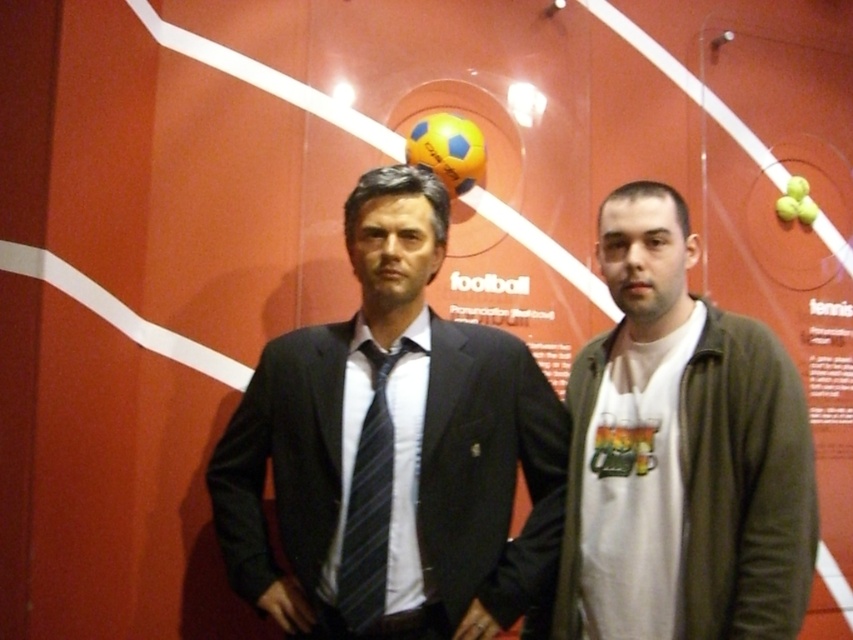
You are a photographer setting up a shoot with two models dressed in dark blue suit at center and black striped tie at center. The client wants the suit to be visible above the tie in the final photo. Based on the scene description, will this requirement be naturally fulfilled?

The dark blue suit at center is already positioned above the black striped tie at center in the scene, so the requirement for the suit to be visible above the tie will be naturally fulfilled.

You are standing in front of a sports advertisement poster. You see two points marked on the poster at coordinates point (x=306, y=346) and point (x=695, y=403). Which point appears closer to you?

Point (x=306, y=346) is further to the viewer than point (x=695, y=403), so the point (x=306, y=346) appears closer to you.